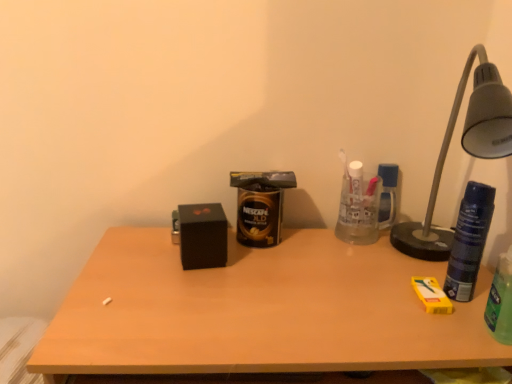
The height and width of the screenshot is (384, 512). In order to click on vacant space that's between blue textured can at right, which is the 2th beverage from front to back, and gold metallic can at center, the 1th beverage in the left-to-right sequence in this screenshot , I will do tap(341, 262).